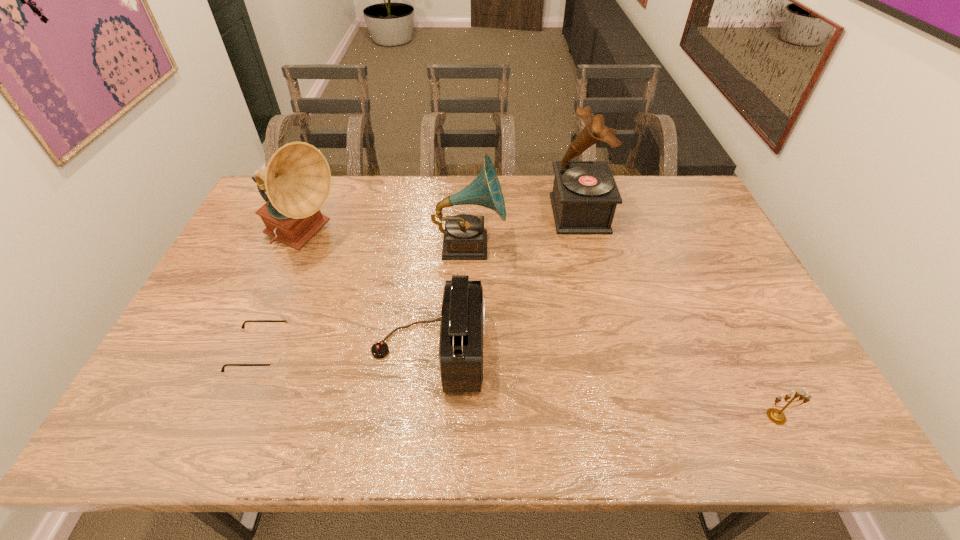
I want to click on object that is at the far left corner, so click(x=297, y=179).

Identify the location of object that is at the near right corner. The width and height of the screenshot is (960, 540). (777, 416).

In the image, there is a desktop. What are the coordinates of `blank space at the far edge` in the screenshot? It's located at (444, 178).

Identify the location of free space at the near edge of the desktop. (656, 415).

I want to click on vacant space at the left edge of the desktop, so click(x=267, y=274).

Where is `vacant area at the right edge`? This screenshot has height=540, width=960. vacant area at the right edge is located at coordinates (794, 363).

In the image, there is a desktop. Where is `vacant space at the near left corner`? Image resolution: width=960 pixels, height=540 pixels. vacant space at the near left corner is located at coordinates (206, 417).

Identify the location of free space between the third tallest object and the candelabrum. The image size is (960, 540). (623, 331).

At what (x,y) coordinates should I click in order to perform the action: click on unoccupied position between the fourth shortest object and the shortest object. Please return your answer as a coordinate pair (x, y). The image size is (960, 540). Looking at the image, I should click on (365, 298).

You are a GUI agent. You are given a task and a screenshot of the screen. Output one action in this format:
    pyautogui.click(x=<x>, y=<y>)
    Task: Click on the free spot between the radio receiver and the rightmost phonograph_record
    The height and width of the screenshot is (540, 960).
    Given the screenshot: What is the action you would take?
    (504, 281)